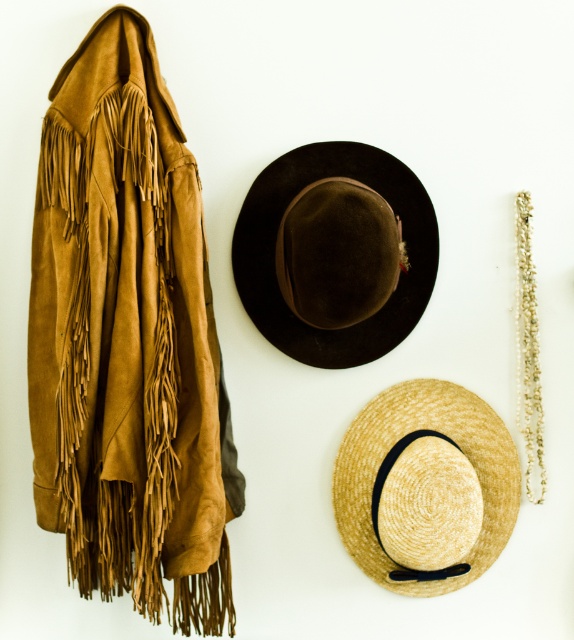
What is the 2D coordinate of the brown felt fedora at center in the image?

The 2D coordinate of the brown felt fedora at center is at point (x=335, y=252).

You are a customer in a boutique and want to see the woven straw hat at center clearly. The suede fringe jacket at left is blocking your view. Can you move the jacket to the side?

The suede fringe jacket at left is in front of the woven straw hat at center, so moving the jacket would allow you to see the hat clearly.